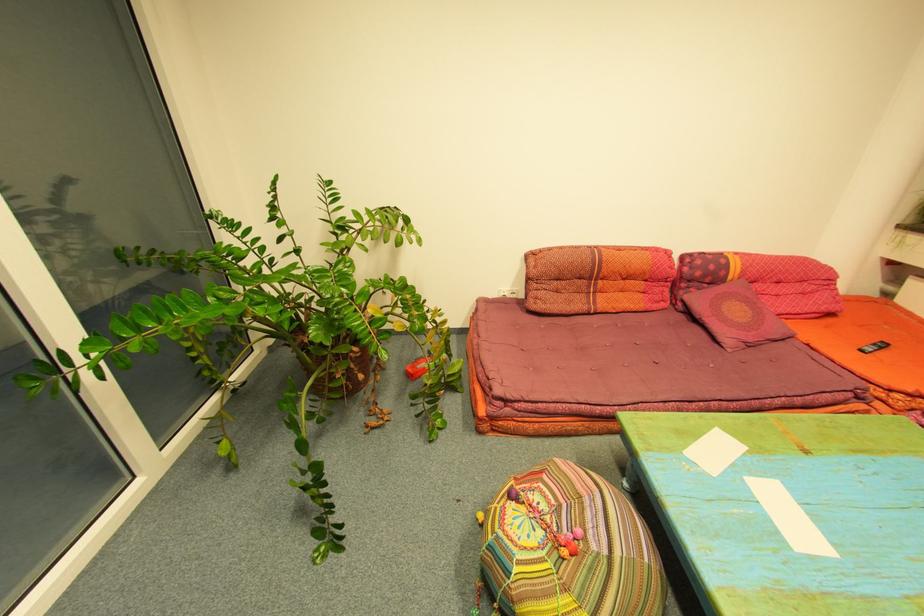
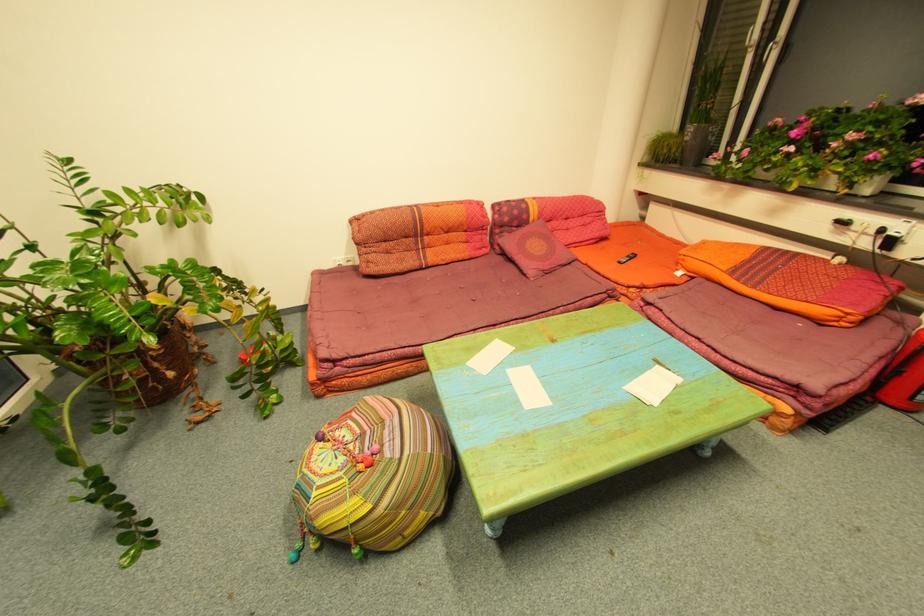
Question: The camera is either moving clockwise (left) or counter-clockwise (right) around the object. The first image is from the beginning of the video and the second image is from the end. Is the camera moving left or right when shooting the video?

Choices:
 (A) Left
 (B) Right

Answer: (A)